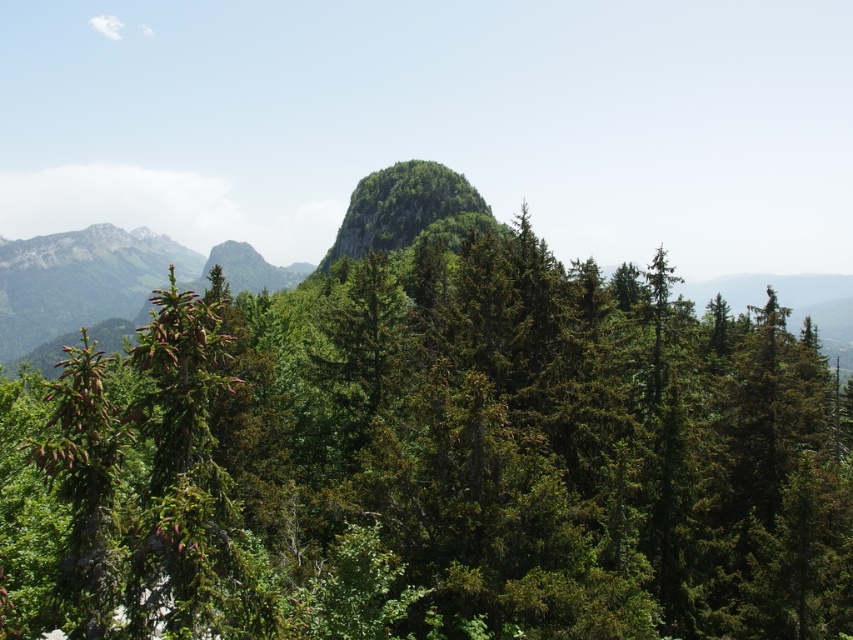
Is green matte tree at center shorter than green leafy peak at center?

Indeed, green matte tree at center has a lesser height compared to green leafy peak at center.

Is the position of green matte tree at center more distant than that of green leafy peak at center?

That is False.

Which is in front, point (717, 486) or point (447, 234)?

Point (717, 486) is more forward.

I want to click on green matte tree at center, so click(x=433, y=461).

Can you confirm if green leafy mountain at left is wider than green leafy peak at center?

Yes.

Who is higher up, green leafy mountain at left or green leafy peak at center?

green leafy peak at center is higher up.

What do you see at coordinates (106, 284) in the screenshot? I see `green leafy mountain at left` at bounding box center [106, 284].

Where is `green leafy mountain at left`? The image size is (853, 640). green leafy mountain at left is located at coordinates (106, 284).

Between green matte tree at center and green leafy mountain at left, which one has more height?

Standing taller between the two is green leafy mountain at left.

Does point (529, 596) lie behind point (47, 372)?

No.

Who is more distant from viewer, (16, 484) or (22, 314)?

Point (22, 314)

I want to click on green matte tree at center, so click(433, 461).